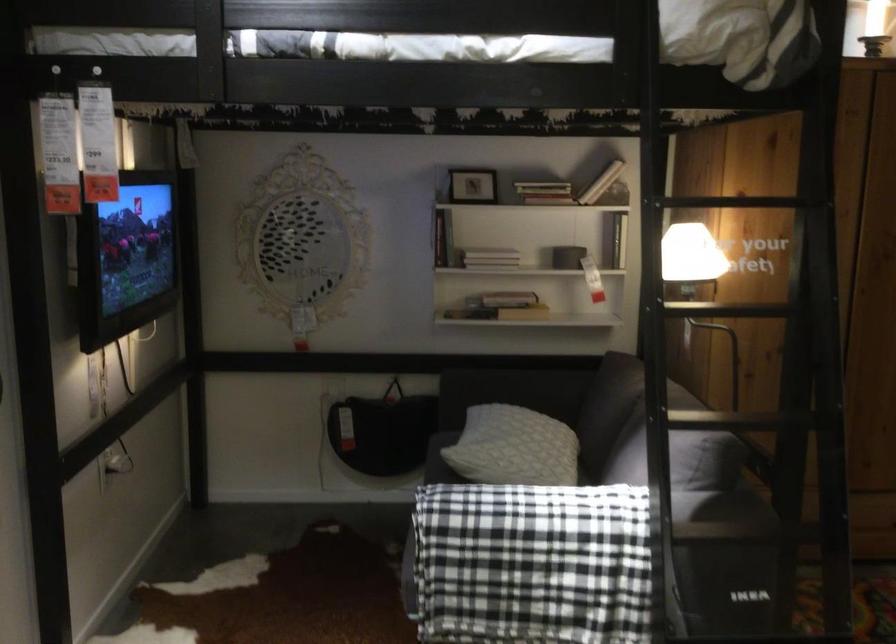
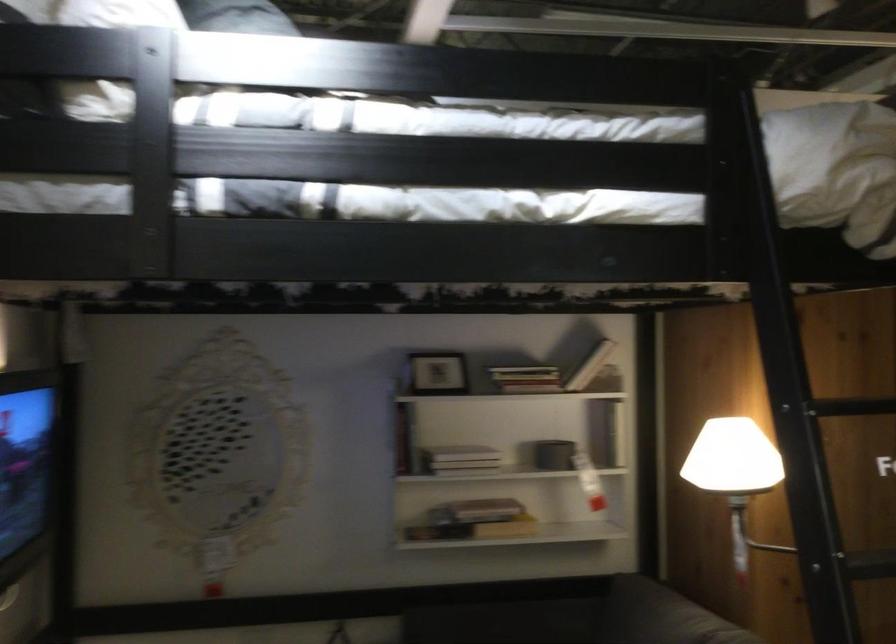
Find the pixel in the second image that matches [474,180] in the first image.

(437, 373)